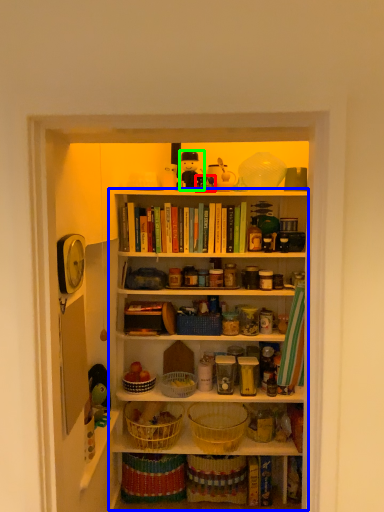
Question: Based on their relative distances, which object is farther from toy (highlighted by a red box)? Choose from shelf (highlighted by a blue box) and toy (highlighted by a green box).

Choices:
 (A) shelf
 (B) toy

Answer: (A)